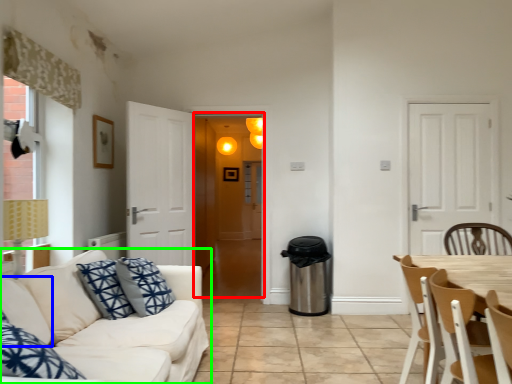
Question: Which object is the farthest from screen door (highlighted by a red box)? Choose among these: pillow (highlighted by a blue box) or studio couch (highlighted by a green box).

Choices:
 (A) pillow
 (B) studio couch

Answer: (A)